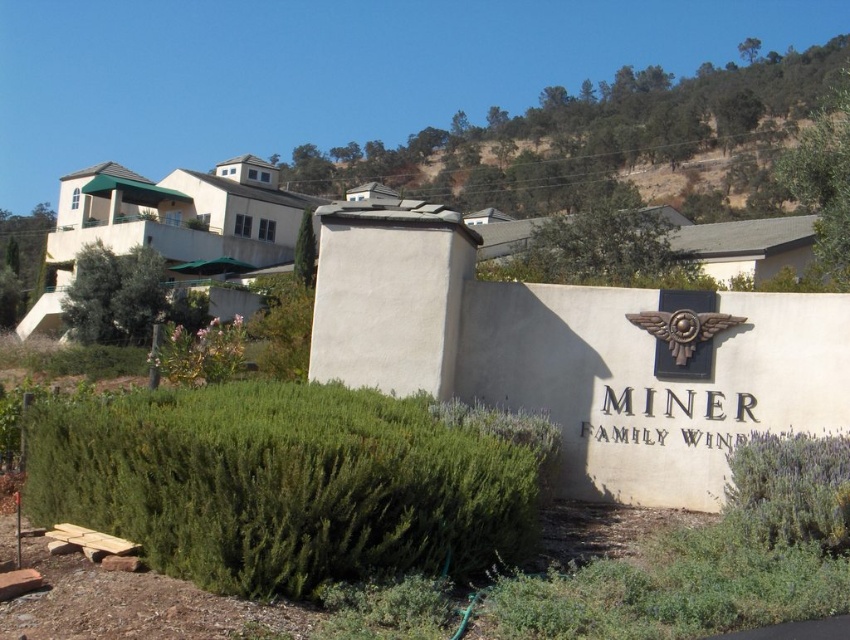
Question: Can you confirm if green leafy hedge at lower center is positioned to the right of dull brown dirt at upper center?

Choices:
 (A) yes
 (B) no

Answer: (B)

Question: Can you confirm if green leafy hedge at lower center is smaller than dull brown dirt at upper center?

Choices:
 (A) no
 (B) yes

Answer: (B)

Question: Which object appears farthest from the camera in this image?

Choices:
 (A) dull brown dirt at upper center
 (B) green leafy bush at upper right
 (C) green leafy hedge at lower right

Answer: (A)

Question: Estimate the real-world distances between objects in this image. Which object is closer to the green leafy hedge at lower center?

Choices:
 (A) green leafy hedge at lower right
 (B) dull brown dirt at upper center
 (C) green leafy bush at upper right

Answer: (A)

Question: Which point is farther from the camera taking this photo?

Choices:
 (A) (116, 276)
 (B) (182, 568)
 (C) (833, 540)

Answer: (A)

Question: Does dull brown dirt at upper center come in front of green leafy bush at upper right?

Choices:
 (A) no
 (B) yes

Answer: (A)